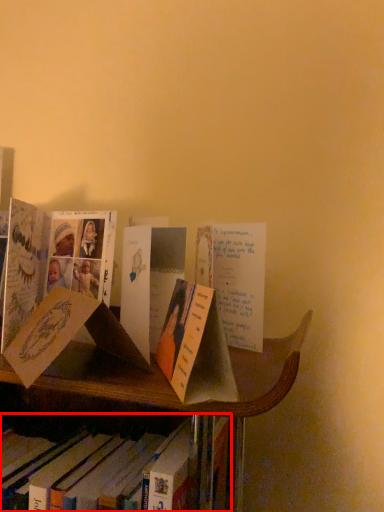
Question: From the image's perspective, what is the correct spatial relationship of book (annotated by the red box) in relation to book?

Choices:
 (A) above
 (B) below

Answer: (B)